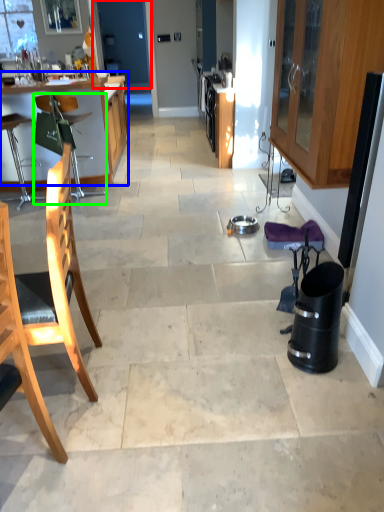
Question: Considering the real-world distances, which object is farthest from screen door (highlighted by a red box)? table (highlighted by a blue box) or chair (highlighted by a green box)?

Choices:
 (A) table
 (B) chair

Answer: (B)